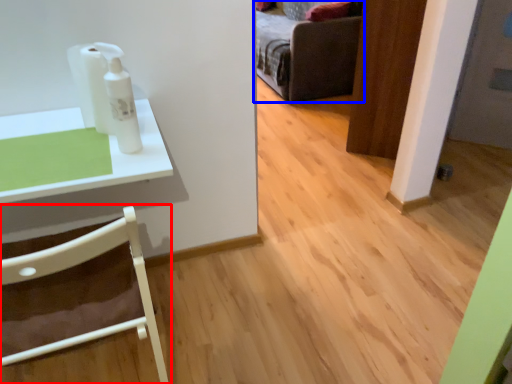
Question: Which point is closer to the camera, chair (highlighted by a red box) or furniture (highlighted by a blue box)?

Choices:
 (A) chair
 (B) furniture

Answer: (A)